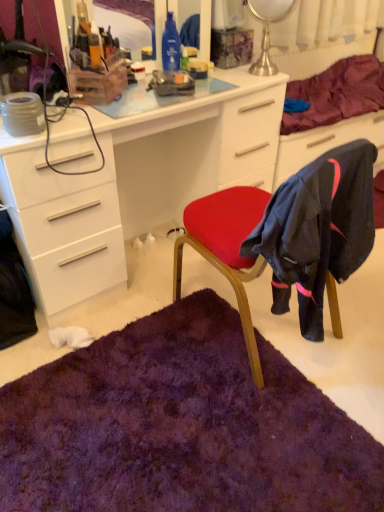
Find the location of a particular element. This screenshot has height=512, width=384. clear plastic organizer at upper center is located at coordinates (48, 25).

The image size is (384, 512). What do you see at coordinates (289, 237) in the screenshot?
I see `velvet red chair at center` at bounding box center [289, 237].

Image resolution: width=384 pixels, height=512 pixels. Identify the location of purple shaggy rug at lower center. (181, 426).

You are a GUI agent. You are given a task and a screenshot of the screen. Output one action in this format:
    pyautogui.click(x=<x>, y=<y>)
    Task: Click on the metallic silver table lamp at upper center
    
    Given the screenshot: What is the action you would take?
    pyautogui.click(x=267, y=29)

What are the coordinates of `clear plastic organizer at upper center` in the screenshot? It's located at (48, 25).

Can velvet red chair at center be found inside purple soft fabric at upper right?

Definitely not — velvet red chair at center is not inside purple soft fabric at upper right.

Is point (382, 65) farther from viewer compared to point (360, 195)?

Yes, it is behind point (360, 195).

Is purple soft fabric at upper right looking in the opposite direction of velvet red chair at center?

No, purple soft fabric at upper right's orientation is not away from velvet red chair at center.

Who is shorter, purple soft fabric at upper right or velvet red chair at center?

purple soft fabric at upper right.

In the scene shown: Which of these two, purple shaggy rug at lower center or purple soft fabric at upper right, is wider?

Wider between the two is purple shaggy rug at lower center.

Can purple soft fabric at upper right be found inside purple shaggy rug at lower center?

Definitely not — purple soft fabric at upper right is not inside purple shaggy rug at lower center.

From the image's perspective, would you say purple shaggy rug at lower center is positioned over purple soft fabric at upper right?

No, from the image's perspective, purple shaggy rug at lower center is not on top of purple soft fabric at upper right.

Is clear plastic organizer at upper center wider or thinner than white glossy desk at center?

clear plastic organizer at upper center is thinner than white glossy desk at center.

From the picture: Could you tell me if clear plastic organizer at upper center is turned towards white glossy desk at center?

No, clear plastic organizer at upper center is not aimed at white glossy desk at center.

Is clear plastic organizer at upper center taller or shorter than white glossy desk at center?

clear plastic organizer at upper center is shorter than white glossy desk at center.

From the image's perspective, between clear plastic organizer at upper center and white glossy desk at center, which one is located above?

clear plastic organizer at upper center, from the image's perspective.

Is purple shaggy rug at lower center surrounding white glossy desk at center?

No, purple shaggy rug at lower center does not contain white glossy desk at center.

Is purple shaggy rug at lower center positioned far away from white glossy desk at center?

No, purple shaggy rug at lower center is in close proximity to white glossy desk at center.

Based on the photo, which object is more forward, purple shaggy rug at lower center or white glossy desk at center?

purple shaggy rug at lower center is more forward.

Considering the points (321, 183) and (166, 501), which point is in front, point (321, 183) or point (166, 501)?

The point (321, 183) is in front.

The height and width of the screenshot is (512, 384). In order to click on mat lying below the velvet red chair at center (from the image's perspective) in this screenshot , I will do `click(181, 426)`.

Based on the photo, is velvet red chair at center aimed at purple shaggy rug at lower center?

No, velvet red chair at center is not aimed at purple shaggy rug at lower center.

Is white glossy desk at center next to purple shaggy rug at lower center?

No, white glossy desk at center is not beside purple shaggy rug at lower center.

Based on the photo, which object is closer to the camera, white glossy desk at center or purple shaggy rug at lower center?

purple shaggy rug at lower center is more forward.

From the image's perspective, is white glossy desk at center located above purple shaggy rug at lower center?

Correct, white glossy desk at center appears higher than purple shaggy rug at lower center in the image.

Which of these two, white glossy desk at center or purple shaggy rug at lower center, is thinner?

white glossy desk at center.

Can you confirm if purple soft fabric at upper right is shorter than clear plastic organizer at upper center?

Yes, purple soft fabric at upper right is shorter than clear plastic organizer at upper center.

Is purple soft fabric at upper right in front of or behind clear plastic organizer at upper center in the image?

purple soft fabric at upper right is behind clear plastic organizer at upper center.

Does purple soft fabric at upper right have a larger size compared to clear plastic organizer at upper center?

Yes.

Which is less distant, [332,109] or [187,0]?

The point [332,109] is in front.

The width and height of the screenshot is (384, 512). I want to click on chair lying below the purple soft fabric at upper right (from the image's perspective), so click(289, 237).

You are a GUI agent. You are given a task and a screenshot of the screen. Output one action in this format:
    pyautogui.click(x=<x>, y=<y>)
    Task: Click on the bedding lying above the purple shaggy rug at lower center (from the image's perspective)
    The height and width of the screenshot is (512, 384).
    Given the screenshot: What is the action you would take?
    pyautogui.click(x=336, y=94)

When comparing their distances from white glossy desk at center, does purple shaggy rug at lower center or purple soft fabric at upper right seem closer?

Based on the image, purple soft fabric at upper right appears to be nearer to white glossy desk at center.

Which object lies further to the anchor point purple soft fabric at upper right, metallic silver table lamp at upper center or clear plastic organizer at upper center?

clear plastic organizer at upper center lies further to purple soft fabric at upper right than the other object.

Based on their spatial positions, is purple soft fabric at upper right or white glossy desk at center further from metallic silver table lamp at upper center?

white glossy desk at center lies further to metallic silver table lamp at upper center than the other object.

Based on their spatial positions, is purple soft fabric at upper right or purple shaggy rug at lower center closer to white glossy desk at center?

purple soft fabric at upper right lies closer to white glossy desk at center than the other object.

Looking at the image, which one is located further to velvet red chair at center, purple shaggy rug at lower center or white glossy desk at center?

white glossy desk at center is positioned further to the anchor velvet red chair at center.

Considering their positions, is white glossy desk at center positioned closer to purple soft fabric at upper right than clear plastic organizer at upper center?

white glossy desk at center is closer to purple soft fabric at upper right.

From the image, which object appears to be farther from white glossy desk at center, purple soft fabric at upper right or metallic silver table lamp at upper center?

purple soft fabric at upper right is positioned further to the anchor white glossy desk at center.

Based on their spatial positions, is purple shaggy rug at lower center or velvet red chair at center further from white glossy desk at center?

Among the two, purple shaggy rug at lower center is located further to white glossy desk at center.

This screenshot has width=384, height=512. In order to click on chair between metallic silver table lamp at upper center and purple shaggy rug at lower center in the up-down direction in this screenshot , I will do `click(289, 237)`.

In order to click on chair located between clear plastic organizer at upper center and purple soft fabric at upper right in the left-right direction in this screenshot , I will do `click(289, 237)`.

Locate an element on the screen. The width and height of the screenshot is (384, 512). chair between purple soft fabric at upper right and purple shaggy rug at lower center in the vertical direction is located at coordinates (289, 237).

Locate an element on the screen. table lamp between white glossy desk at center and purple soft fabric at upper right from left to right is located at coordinates (267, 29).